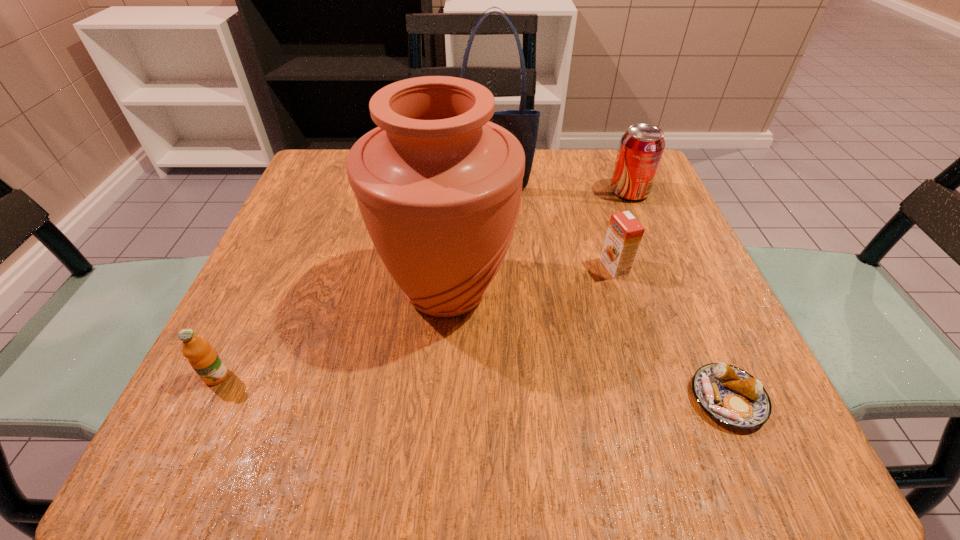
Image resolution: width=960 pixels, height=540 pixels. Find the location of `shopping bag`. shopping bag is located at coordinates (523, 124).

The height and width of the screenshot is (540, 960). Find the location of `vase`. vase is located at coordinates (439, 186).

I want to click on the fourth shortest object, so click(641, 148).

At what (x,y) coordinates should I click in order to perform the action: click on the third object from right to left. Please return your answer as a coordinate pair (x, y). Image resolution: width=960 pixels, height=540 pixels. Looking at the image, I should click on tap(624, 234).

In order to click on the farther orange juice in this screenshot , I will do `click(624, 234)`.

Locate an element on the screen. the left orange juice is located at coordinates (203, 358).

I want to click on the nearer orange juice, so point(203,358).

Identify the location of pastry. (730, 395).

Locate an element on the screen. This screenshot has height=540, width=960. free space located 0.090m on the front-facing side of the shopping bag is located at coordinates (492, 219).

Where is `vacant space located 0.100m on the right of the vase`? This screenshot has height=540, width=960. vacant space located 0.100m on the right of the vase is located at coordinates (572, 289).